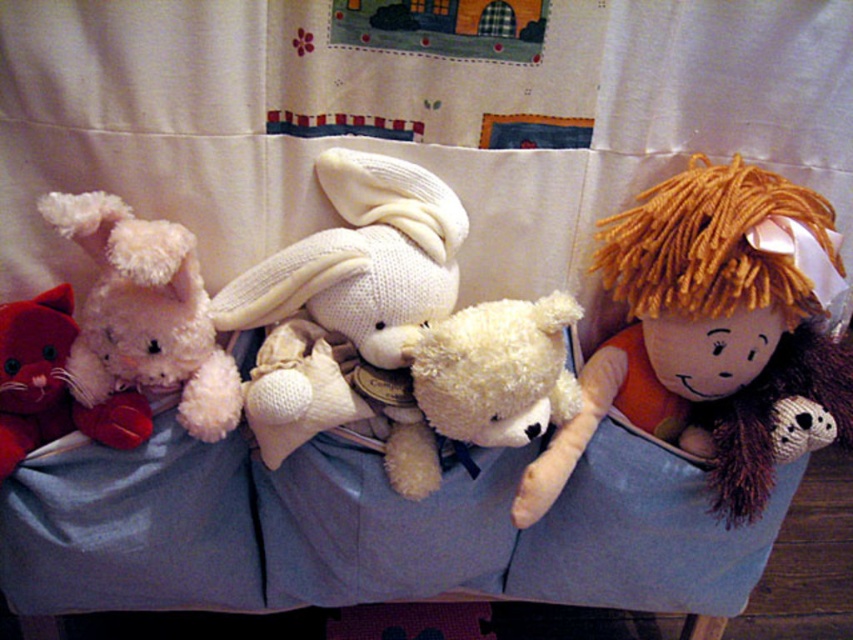
Question: Among these objects, which one is nearest to the camera?

Choices:
 (A) velvet red cat at left
 (B) fluffy white teddy bear at center

Answer: (A)

Question: Is yarn doll at right positioned behind fluffy white teddy bear at center?

Choices:
 (A) no
 (B) yes

Answer: (A)

Question: Does yarn doll at right have a greater width compared to knitted white rabbit at center?

Choices:
 (A) no
 (B) yes

Answer: (B)

Question: Which object is the closest to the fluffy white teddy bear at center?

Choices:
 (A) velvet red cat at left
 (B) knitted white rabbit at center
 (C) yarn doll at right

Answer: (B)

Question: Which point is closer to the camera?

Choices:
 (A) (7, 317)
 (B) (740, 365)

Answer: (A)

Question: Is fluffy white teddy bear at left wider than velvet red cat at left?

Choices:
 (A) yes
 (B) no

Answer: (A)